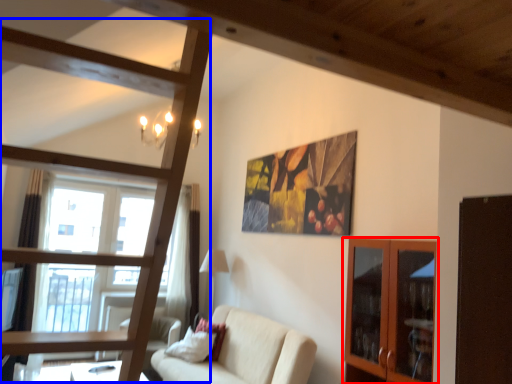
Question: Which object appears farthest to the camera in this image, cabinetry (highlighted by a red box) or bunk bed (highlighted by a blue box)?

Choices:
 (A) cabinetry
 (B) bunk bed

Answer: (A)